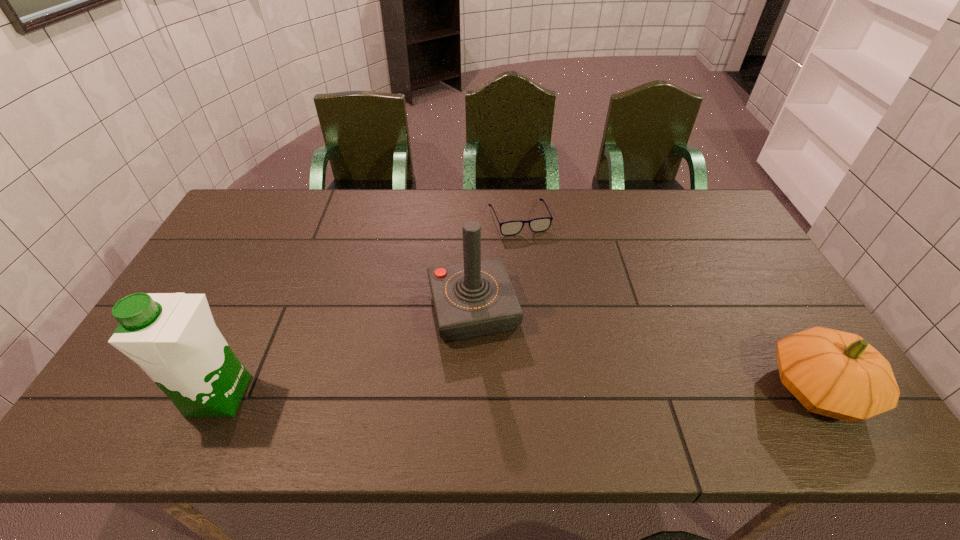
Locate an element on the screen. The height and width of the screenshot is (540, 960). the leftmost object is located at coordinates (173, 337).

Find the location of a particular element. The image size is (960, 540). the second shortest object is located at coordinates (837, 374).

Locate an element on the screen. The image size is (960, 540). the rightmost object is located at coordinates point(837,374).

This screenshot has height=540, width=960. I want to click on spectacles, so click(x=509, y=228).

Locate an element on the screen. the farthest object is located at coordinates (509, 228).

The width and height of the screenshot is (960, 540). Identify the location of the third nearest object. (476, 298).

Identify the location of free spot located on the front-facing side of the leftmost object. The image size is (960, 540). (142, 396).

Locate an element on the screen. free region located 0.130m on the front-facing side of the leftmost object is located at coordinates point(133,396).

Where is `vacant region located 0.100m on the front-facing side of the leftmost object`? The height and width of the screenshot is (540, 960). vacant region located 0.100m on the front-facing side of the leftmost object is located at coordinates (146, 396).

Locate an element on the screen. vacant space located on the front-facing side of the shortest object is located at coordinates (545, 282).